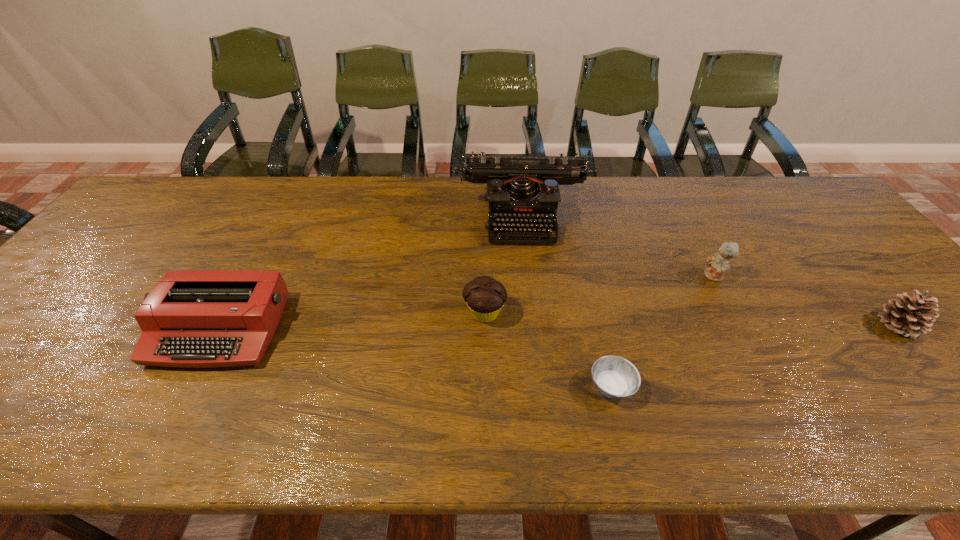
This screenshot has width=960, height=540. What are the coordinates of `vacant space positioned 0.270m on the front-facing side of the fifth object from left to right` in the screenshot? It's located at (604, 276).

This screenshot has height=540, width=960. Find the location of `vacant space located 0.230m on the front-facing side of the fifth object from left to right`. vacant space located 0.230m on the front-facing side of the fifth object from left to right is located at coordinates (618, 276).

Locate an element on the screen. vacant region located 0.110m on the front-facing side of the fifth object from left to right is located at coordinates coord(663,276).

I want to click on vacant area situated 0.230m on the left of the pinecone, so click(782, 326).

Where is `vacant position located on the right of the muffin`? vacant position located on the right of the muffin is located at coordinates (595, 313).

This screenshot has height=540, width=960. Identify the location of vacant space located 0.070m on the typing side of the nearer typewriter. (182, 400).

Locate an element on the screen. The image size is (960, 540). free spot located 0.220m on the right of the ashtray is located at coordinates (738, 387).

The height and width of the screenshot is (540, 960). Identify the location of object present at the far edge. (524, 190).

You are a GUI agent. You are given a task and a screenshot of the screen. Output one action in this format:
    pyautogui.click(x=<x>, y=<y>)
    Task: Click on the object located at the near edge
    The image size is (960, 540).
    Given the screenshot: What is the action you would take?
    pyautogui.click(x=614, y=377)

Find the location of `object located in the right edge section of the desktop`. object located in the right edge section of the desktop is located at coordinates 910,316.